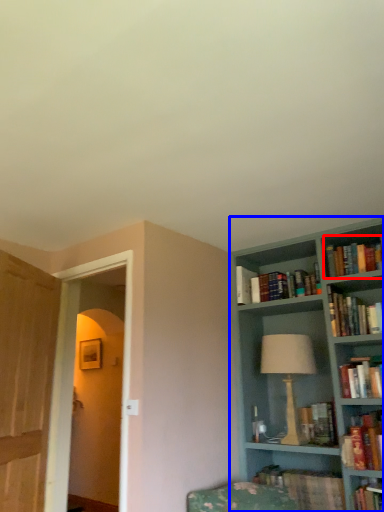
Question: Which object appears closest to the camera in this image, book (highlighted by a red box) or bookcase (highlighted by a blue box)?

Choices:
 (A) book
 (B) bookcase

Answer: (B)